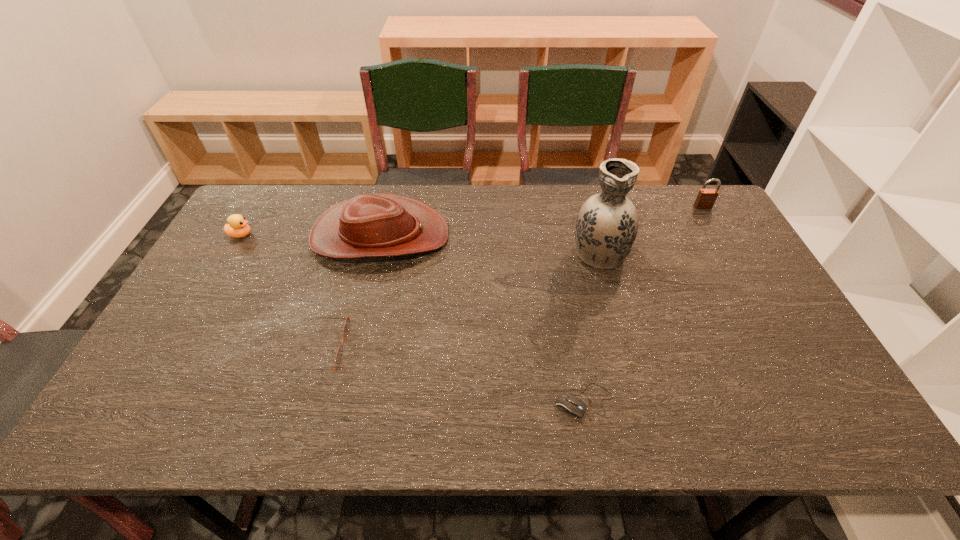
Identify the location of vacant point that satisfies the following two spatial constraints: 1. on the front-facing side of the padlock; 2. on the face of the fifth farthest object. The image size is (960, 540). (784, 348).

Where is `free region that satisfies the following two spatial constraints: 1. on the front-facing side of the nearest object; 2. on the right side of the cowboy hat`? free region that satisfies the following two spatial constraints: 1. on the front-facing side of the nearest object; 2. on the right side of the cowboy hat is located at coordinates (341, 401).

Identify the location of vacant space that satisfies the following two spatial constraints: 1. on the face of the computer mouse; 2. on the left side of the fifth farthest object. The image size is (960, 540). (307, 401).

The width and height of the screenshot is (960, 540). In order to click on free spot that satisfies the following two spatial constraints: 1. on the face of the leftmost object; 2. on the left side of the shortest object in this screenshot , I will do `click(145, 401)`.

This screenshot has height=540, width=960. I want to click on free spot that satisfies the following two spatial constraints: 1. with the handle on the side of the vase; 2. on the front-facing side of the cowboy hat, so click(x=594, y=235).

Locate an element on the screen. The height and width of the screenshot is (540, 960). vacant space that satisfies the following two spatial constraints: 1. on the face of the sunglasses; 2. on the back side of the nearest object is located at coordinates (307, 401).